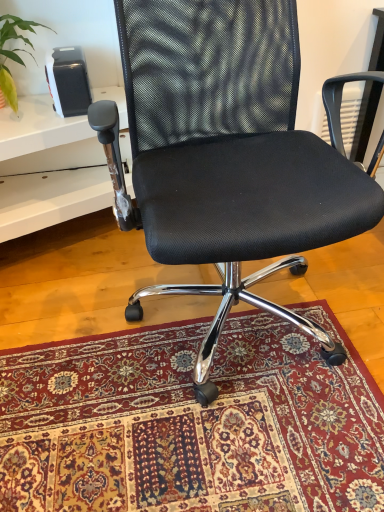
Question: From a real-world perspective, is black mesh office chair at center positioned under green leafy plant at upper left based on gravity?

Choices:
 (A) no
 (B) yes

Answer: (B)

Question: Is black mesh office chair at center wider than green leafy plant at upper left?

Choices:
 (A) yes
 (B) no

Answer: (A)

Question: Can you confirm if black mesh office chair at center is smaller than green leafy plant at upper left?

Choices:
 (A) no
 (B) yes

Answer: (A)

Question: Are black mesh office chair at center and green leafy plant at upper left making contact?

Choices:
 (A) yes
 (B) no

Answer: (B)

Question: Is black mesh office chair at center facing towards green leafy plant at upper left?

Choices:
 (A) yes
 (B) no

Answer: (B)

Question: Is black mesh office chair at center behind green leafy plant at upper left?

Choices:
 (A) no
 (B) yes

Answer: (A)

Question: Is black mesh office chair at center directly adjacent to white plastic table at left?

Choices:
 (A) yes
 (B) no

Answer: (B)

Question: Is black mesh office chair at center bigger than white plastic table at left?

Choices:
 (A) no
 (B) yes

Answer: (B)

Question: From the image's perspective, is black mesh office chair at center under white plastic table at left?

Choices:
 (A) no
 (B) yes

Answer: (B)

Question: Is black mesh office chair at center positioned with its back to white plastic table at left?

Choices:
 (A) yes
 (B) no

Answer: (B)

Question: Does black mesh office chair at center appear on the left side of white plastic table at left?

Choices:
 (A) yes
 (B) no

Answer: (B)

Question: Is black mesh office chair at center positioned before white plastic table at left?

Choices:
 (A) yes
 (B) no

Answer: (A)

Question: From a real-world perspective, does green leafy plant at upper left sit lower than carpeted rug at center?

Choices:
 (A) no
 (B) yes

Answer: (A)